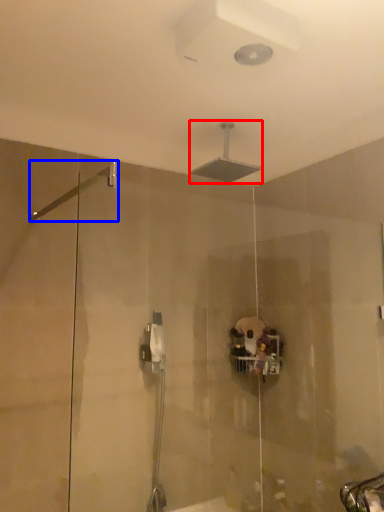
Question: Which object is closer to the camera taking this photo, shower (highlighted by a red box) or shower (highlighted by a blue box)?

Choices:
 (A) shower
 (B) shower

Answer: (B)